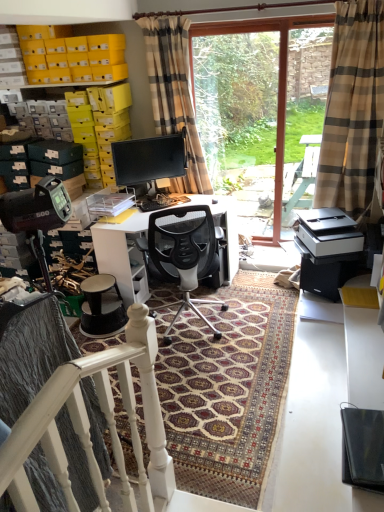
Where is `free space above transparent glass door at center (from a real-world perspective)`? The width and height of the screenshot is (384, 512). free space above transparent glass door at center (from a real-world perspective) is located at coordinates (233, 26).